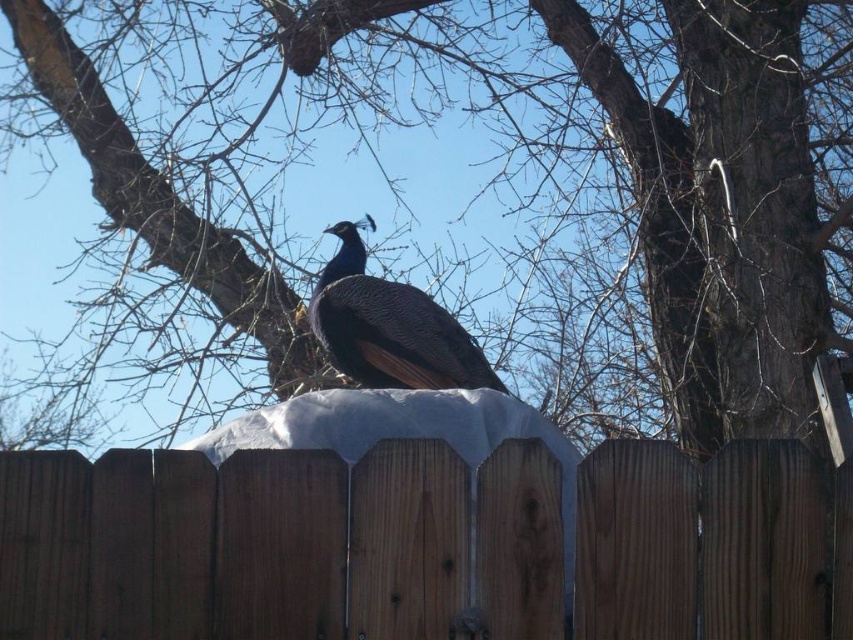
Who is more distant from viewer, (207,168) or (793,474)?

Positioned behind is point (207,168).

Find the location of `brown wood tree at upper center`. brown wood tree at upper center is located at coordinates (485, 186).

Identify the location of brown wood tree at upper center. This screenshot has height=640, width=853. (485, 186).

Is point (751, 506) farther from viewer compared to point (389, 292)?

No, it is in front of (389, 292).

Describe the element at coordinates (276, 545) in the screenshot. I see `brown wooden fence at center` at that location.

Where is `brown wooden fence at center`? brown wooden fence at center is located at coordinates (276, 545).

Describe the element at coordinates (485, 186) in the screenshot. The image size is (853, 640). I see `brown wood tree at upper center` at that location.

Between brown wood tree at upper center and shiny blue peacock at center, which one has more height?

brown wood tree at upper center

Where is `brown wood tree at upper center`? The image size is (853, 640). brown wood tree at upper center is located at coordinates (485, 186).

Identify the location of brown wood tree at upper center. (485, 186).